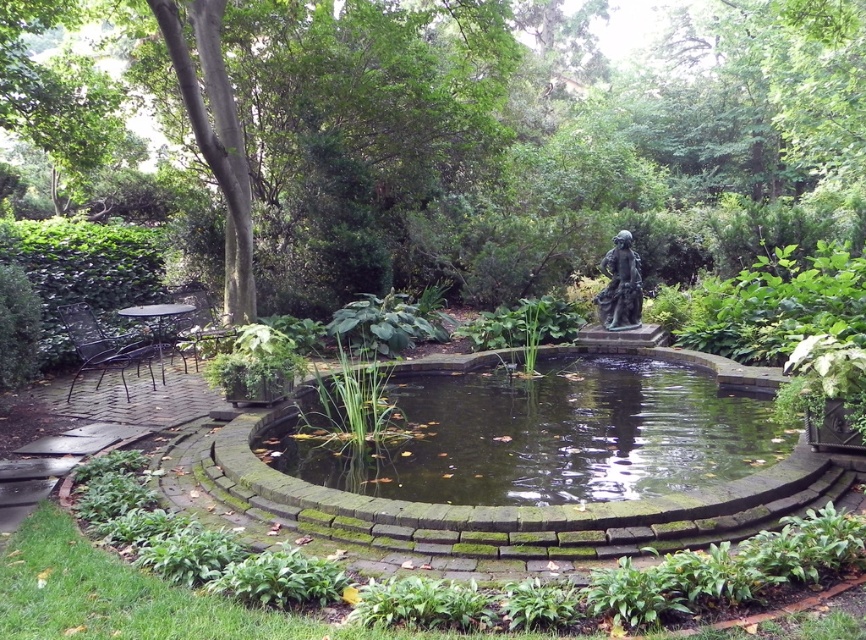
You are a bird looking for a place to perch. You see the green leafy tree at center and the bronze statue at center. Which one would be a better option for perching?

The green leafy tree at center is much taller than the bronze statue at center, so it would provide a better perching option for a bird.

You are standing at the edge of the circular pond and want to find the green leafy tree at center. According to the coordinates provided, in which direction should you look to see the tree?

The green leafy tree at center is located at point coordinates 0.217 on the x and 0.532 on the y. Since the pond is circular and you are at the edge, the tree would be positioned slightly to the left and above your current position if you consider the center of the pond as the reference point.

You are a gardener planning to place a new decorative fountain in the garden. The fountain requires a clear space of 2 meters in diameter. Given the current layout with the green mossy stone pond at center and bronze statue at center, where should you position the fountain to avoid overlapping with these objects?

The green mossy stone pond at center is to the left of the bronze statue at center. To avoid overlapping, the fountain should be placed either to the right of the bronze statue at center or to the right of the green mossy stone pond at center, ensuring a 2 meter diameter space is clear.